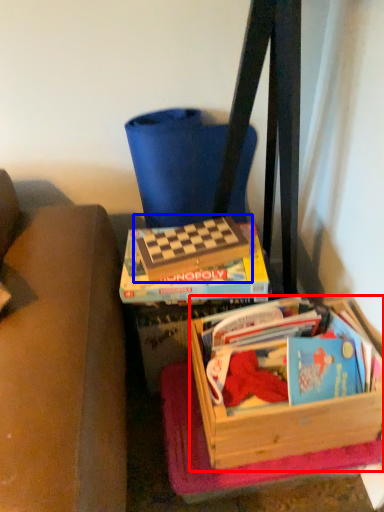
Question: Which object is further to the camera taking this photo, box (highlighted by a red box) or paperback book (highlighted by a blue box)?

Choices:
 (A) box
 (B) paperback book

Answer: (B)